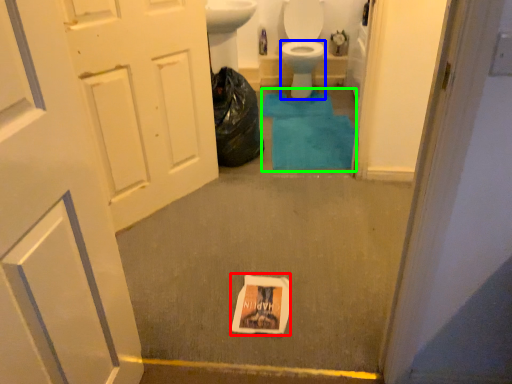
Question: Which is farther away from flyer (highlighted by a red box)? bidet (highlighted by a blue box) or bath mat (highlighted by a green box)?

Choices:
 (A) bidet
 (B) bath mat

Answer: (A)